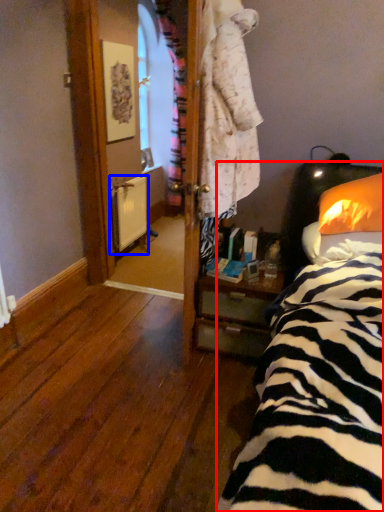
Question: Among these objects, which one is nearest to the camera, bed (highlighted by a red box) or radiator (highlighted by a blue box)?

Choices:
 (A) bed
 (B) radiator

Answer: (A)